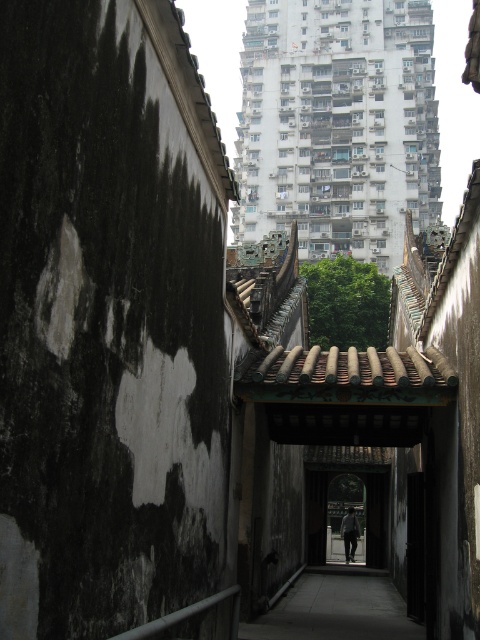
Is smooth concrete path at center taller than dark gray fabric at center?

Yes.

Is point (307, 589) positioned after point (349, 541)?

No, it is not.

This screenshot has height=640, width=480. Describe the element at coordinates (336, 609) in the screenshot. I see `smooth concrete path at center` at that location.

This screenshot has height=640, width=480. In order to click on smooth concrete path at center in this screenshot , I will do `click(336, 609)`.